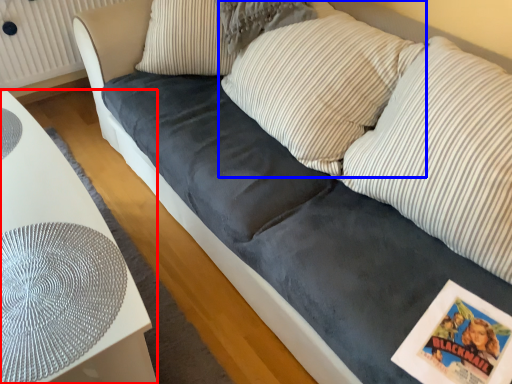
Question: Which object appears farthest to the camera in this image, furniture (highlighted by a red box) or pillow (highlighted by a blue box)?

Choices:
 (A) furniture
 (B) pillow

Answer: (B)